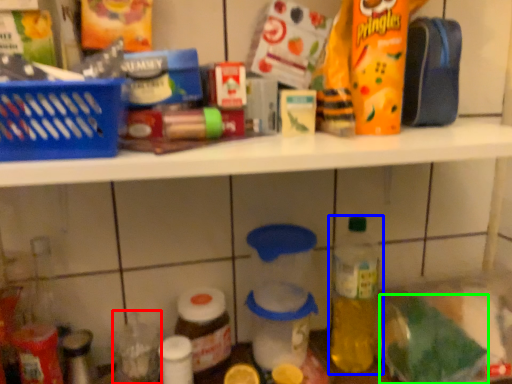
Question: Estimate the real-world distances between objects in this image. Which object is closer to bottle (highlighted by a red box), bottle (highlighted by a blue box) or food (highlighted by a green box)?

Choices:
 (A) bottle
 (B) food

Answer: (A)